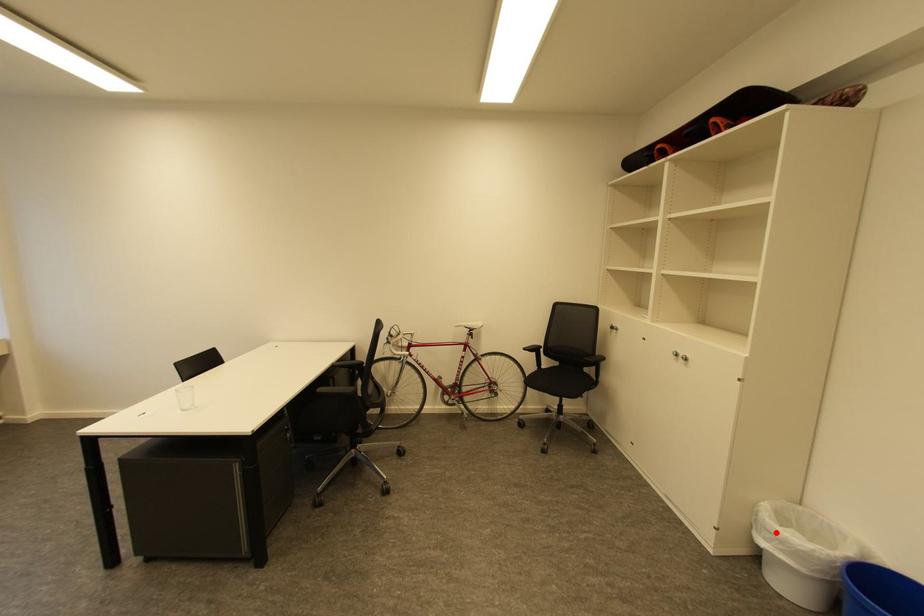
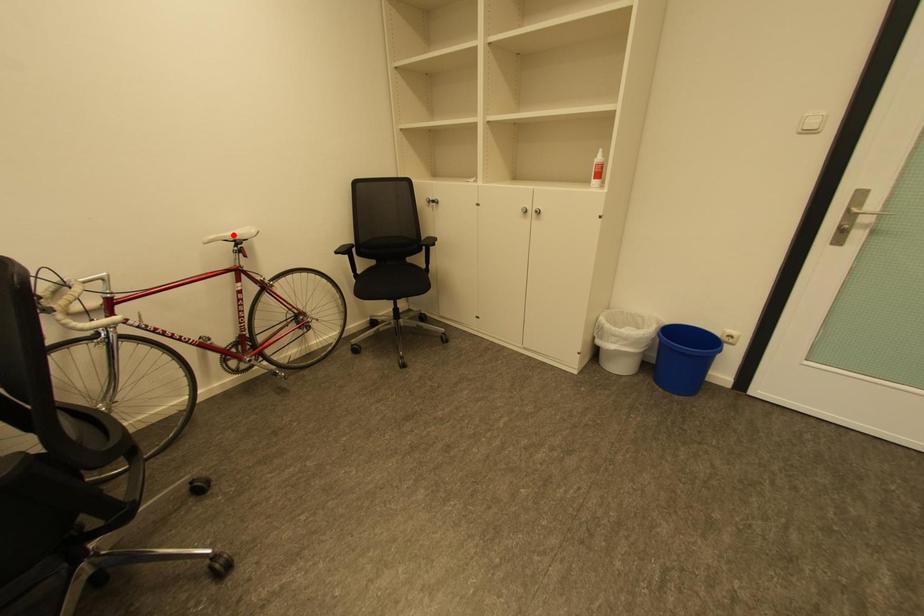
I am providing you with two images of the same scene from different viewpoints. A red point is marked on the first image and another point is marked on the second image. Is the marked point in image1 the same physical position as the marked point in image2?

No